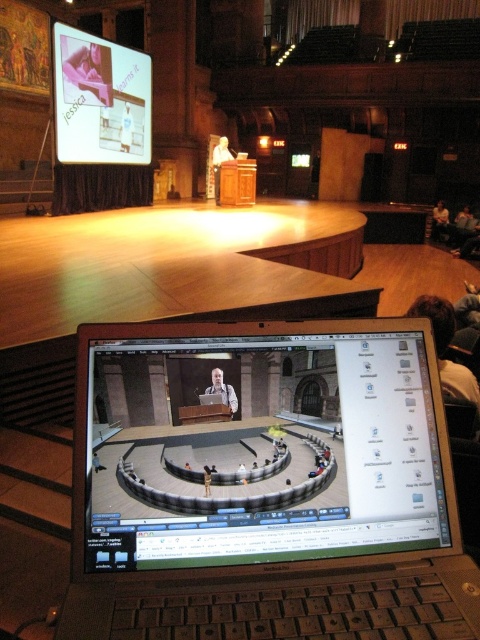
In the scene shown: Can you confirm if silver metallic laptop at center is bigger than dark brown hair at lower right?

No.

Between point (151, 456) and point (441, 385), which one is positioned in front?

Point (151, 456) is in front.

This screenshot has height=640, width=480. Find the location of `silver metallic laptop at center`. silver metallic laptop at center is located at coordinates (269, 500).

Between white shirt at center and dark brown leather jacket at upper right, which one is positioned lower?

white shirt at center

Can you confirm if white shirt at center is thinner than dark brown leather jacket at upper right?

Indeed, white shirt at center has a lesser width compared to dark brown leather jacket at upper right.

Is point (229, 403) positioned behind point (436, 228)?

No, it is in front of (436, 228).

The width and height of the screenshot is (480, 640). I want to click on white shirt at center, so click(x=223, y=390).

Is point (227, 392) closer to camera compared to point (216, 163)?

Yes, it is in front of point (216, 163).

Describe the element at coordinates (223, 390) in the screenshot. The height and width of the screenshot is (640, 480). I see `white shirt at center` at that location.

The height and width of the screenshot is (640, 480). I want to click on white shirt at center, so click(x=223, y=390).